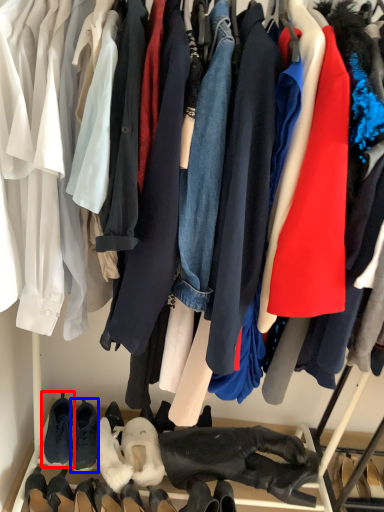
Question: Among these objects, which one is farthest to the camera, footwear (highlighted by a red box) or footwear (highlighted by a blue box)?

Choices:
 (A) footwear
 (B) footwear

Answer: (A)